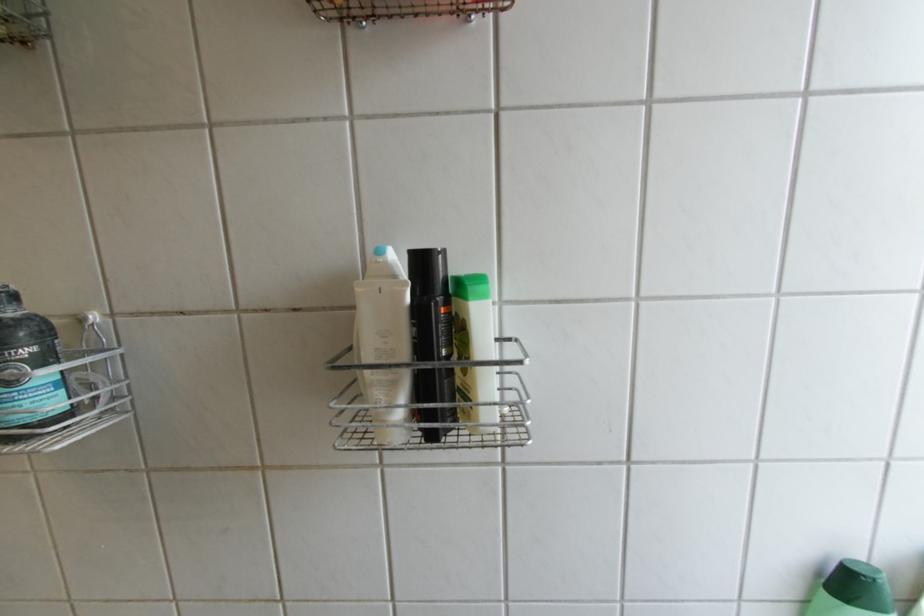
This screenshot has height=616, width=924. What do you see at coordinates (383, 342) in the screenshot?
I see `the bottle pump dispenser` at bounding box center [383, 342].